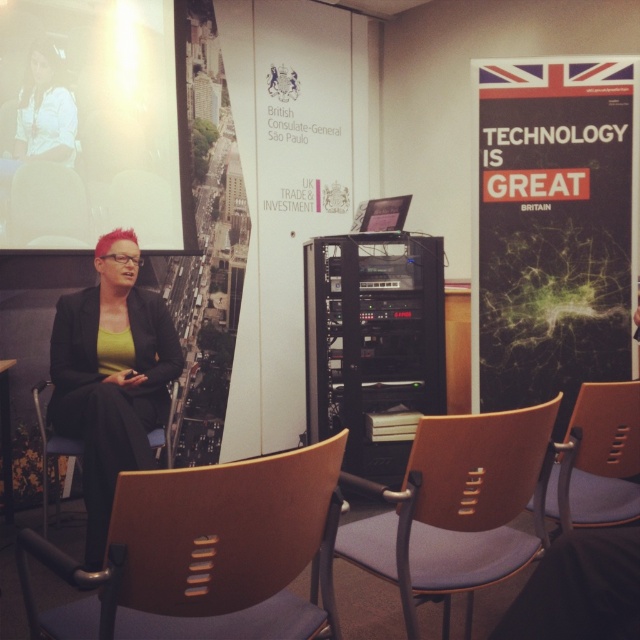
You are organizing a trade event and need to ensure that all materials fit on the display table. The display table can only accommodate items up to the width of the matte black jacket at center. Can the matte black poster at right be placed on the table without being folded or trimmed?

The matte black poster at right is wider than the matte black jacket at center, so it cannot be placed on the table without being folded or trimmed.

You are standing in the conference room and need to locate the matte black poster at right. According to the scene description, where should you look relative to the seated individual?

The matte black poster at right is located at point coordinates of [554,228] in the scene, so you should look to the right side of the seated individual to find it.